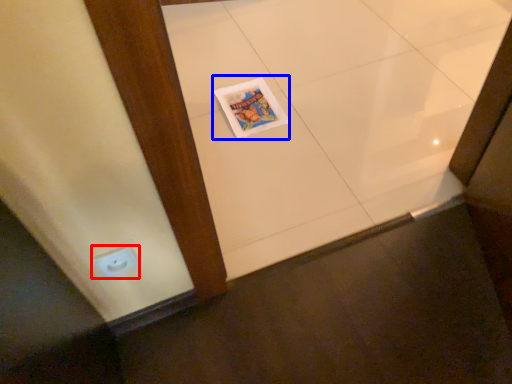
Question: Which object is closer to the camera taking this photo, electric outlet (highlighted by a red box) or magazine (highlighted by a blue box)?

Choices:
 (A) electric outlet
 (B) magazine

Answer: (A)